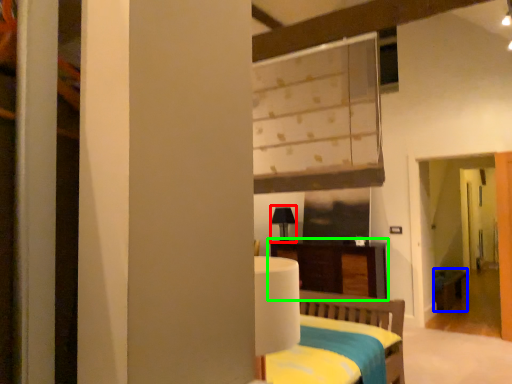
Question: Which is nearer to the table lamp (highlighted by a red box)? table (highlighted by a blue box) or furniture (highlighted by a green box).

Choices:
 (A) table
 (B) furniture

Answer: (B)